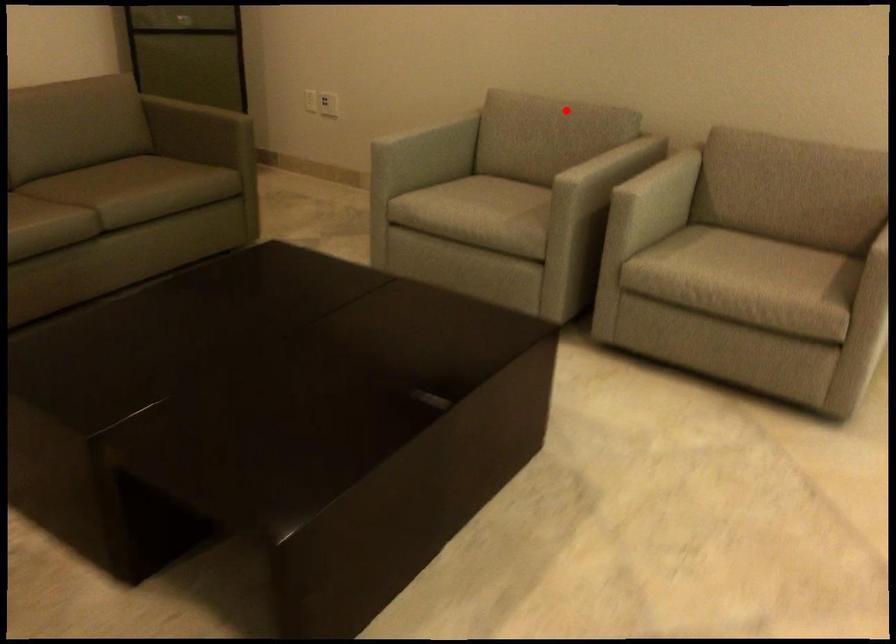
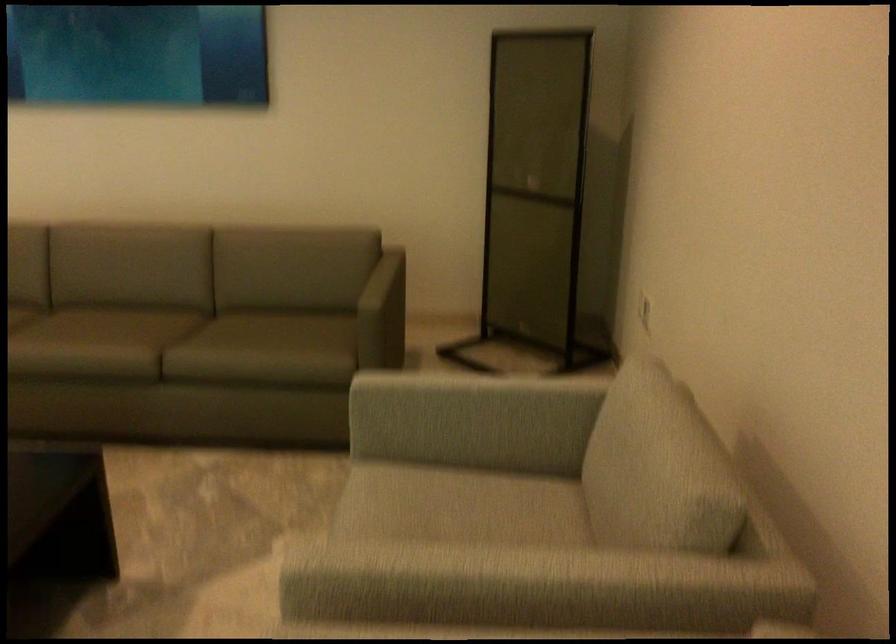
Question: I am providing you with two images of the same scene from different viewpoints. Given a red point in image1, look at the same physical point in image2. Is it:

Choices:
 (A) Closer to the viewpoint
 (B) Farther from the viewpoint

Answer: (A)